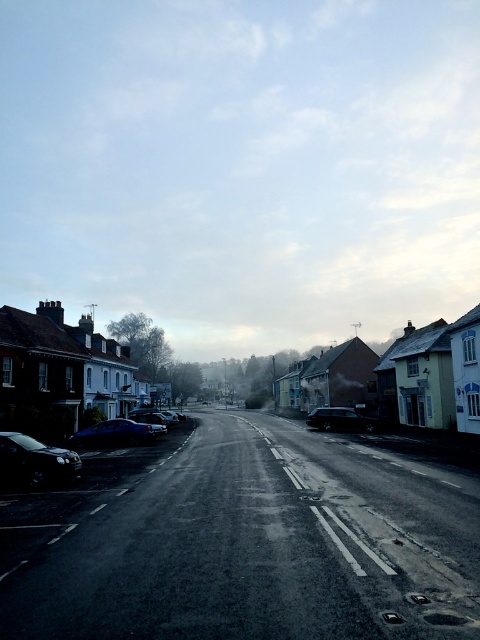
You are a delivery driver who needs to park your vehicle in this street. You have two options for parking spots near the shiny black car at lower left and the metallic blue car at center. Which parking spot would allow you to park your car without overlapping any existing vehicles?

The parking spot near the shiny black car at lower left is better because the shiny black car at lower left occupies less space than the metallic blue car at center, so there is more available space there.

You are a delivery driver who needs to park your vehicle in a narrow alley that can only accommodate cars up to the width of the metallic blue car at center. You have a shiny black car at center. Will your car fit in the alley?

The shiny black car at center is wider than the metallic blue car at center, so it will not fit in the alley designed for cars up to the width of the metallic blue car at center.

A pedestrian is standing at point (320,413) and wants to cross the street to reach the other side. The street is 40.79 meters wide. If the pedestrian walks at a speed of 1.5 meters per second, how many seconds will it take them to cross the street safely?

The pedestrian needs to cross a street that is 40.79 meters wide. At a walking speed of 1.5 meters per second, the time required would be 40.79 divided by 1.5, which equals approximately 27.19 seconds. Therefore, it will take about 27.2 seconds to cross safely.